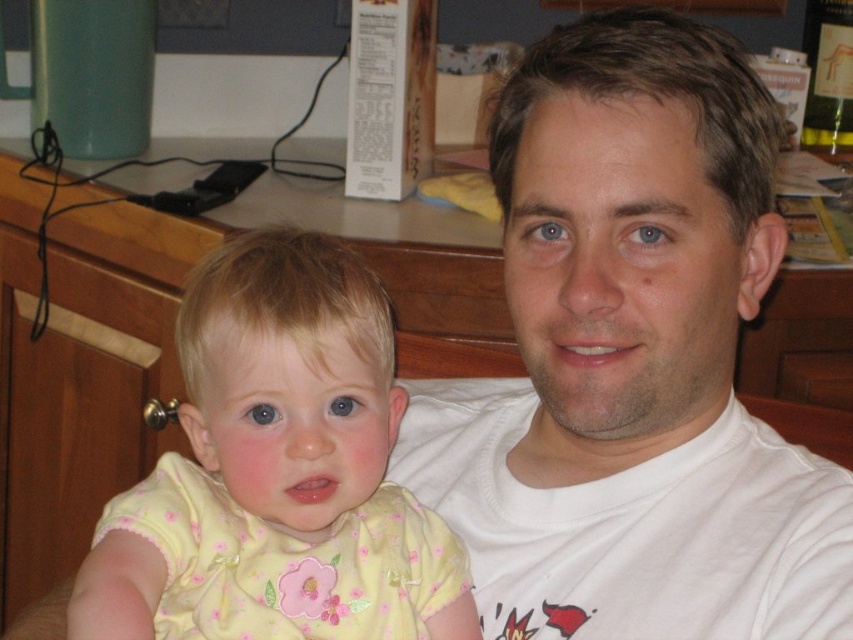
You are helping to organize a laundry day and notice two shirts on the counter. The white cotton shirt at center and the yellow fabric shirt at center. Which shirt is wider?

The white cotton shirt at center is wider than the yellow fabric shirt at center according to the description.

You are trying to decide which shirt to wear for a casual day out. Both the white cotton shirt at center and the yellow fabric shirt at center are options. Based on their sizes, which one is taller?

The white cotton shirt at center is taller than the yellow fabric shirt at center.

You are a photographer setting up for a family portrait. The adult male in white T shirt and the child in yellow outfit are seated at center. There is a point marked at coordinates (631,362) which marks the white cotton shirt at center. To ensure the focus is on their faces, where should you place the focus point relative to their positions?

The focus point should be placed at the coordinates (631,362), which marks the white cotton shirt at center. This position ensures the camera focuses on the adult male in white T shirt and the child in yellow outfit seated at center, keeping their faces in sharp focus.